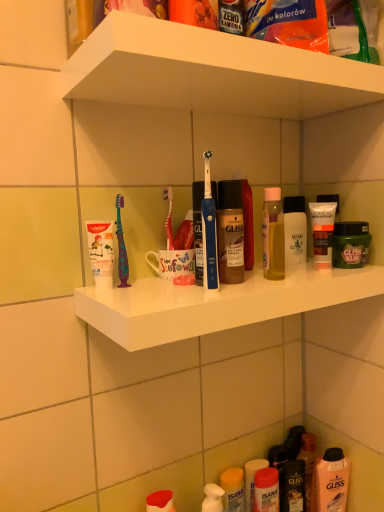
Find the location of a particular element. This screenshot has width=384, height=512. free spot to the left of blue plastic toothbrush at center is located at coordinates (144, 295).